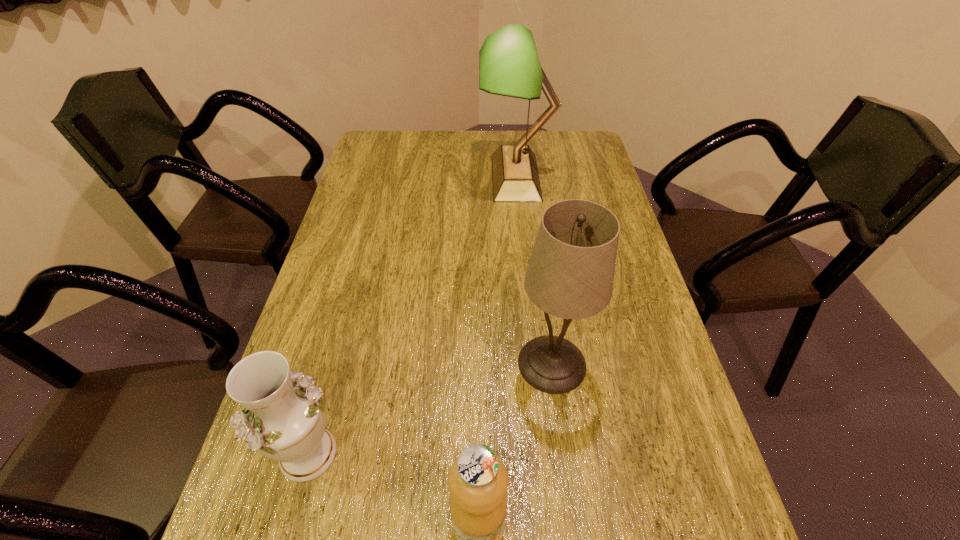
The image size is (960, 540). I want to click on object that stands as the closest to the lampshade, so click(x=478, y=481).

Identify the location of vacant region that satisfies the following two spatial constraints: 1. on the metallic stand of the farthest object; 2. on the front side of the second nearest object. The image size is (960, 540). (543, 454).

Locate an element on the screen. This screenshot has width=960, height=540. blank area in the image that satisfies the following two spatial constraints: 1. on the front-facing side of the lampshade; 2. on the front side of the second nearest object is located at coordinates (564, 454).